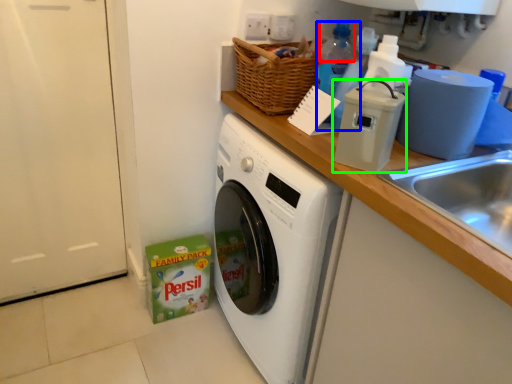
Question: Estimate the real-world distances between objects in this image. Which object is closer to bottle (highlighted by a red box), bottle (highlighted by a blue box) or appliance (highlighted by a green box)?

Choices:
 (A) bottle
 (B) appliance

Answer: (A)